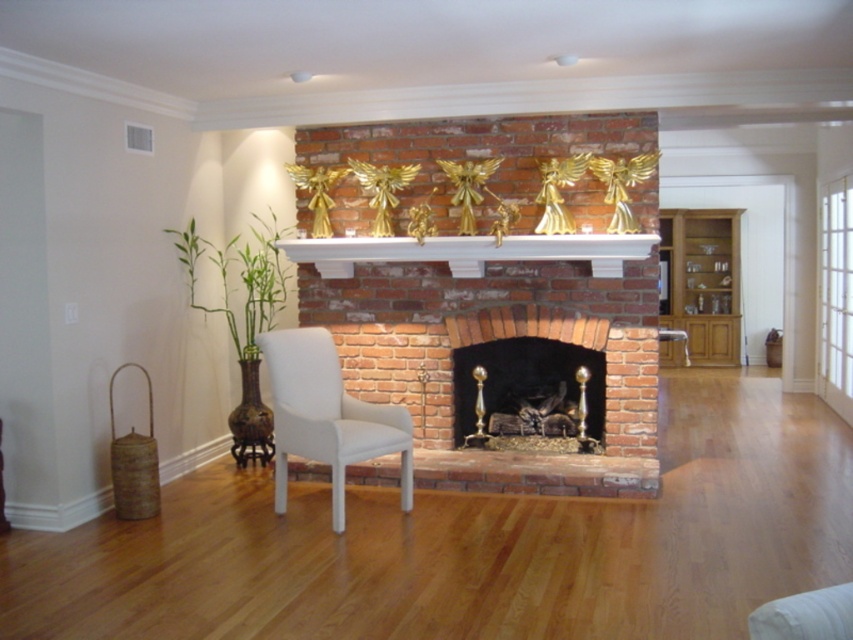
Who is higher up, white painted wood mantle at center or green bamboo at center?

white painted wood mantle at center is higher up.

Find the location of a particular element. Image resolution: width=853 pixels, height=640 pixels. white painted wood mantle at center is located at coordinates (469, 252).

Identify the location of white painted wood mantle at center. Image resolution: width=853 pixels, height=640 pixels. (469, 252).

Who is shorter, brick fireplace at center or white painted wood mantle at center?

With less height is white painted wood mantle at center.

Describe the element at coordinates (498, 339) in the screenshot. I see `brick fireplace at center` at that location.

Identify the location of brick fireplace at center. (498, 339).

Which is below, white matte armchair at center or white painted wood mantle at center?

white matte armchair at center is lower down.

Does white matte armchair at center have a greater width compared to white painted wood mantle at center?

No.

Describe the element at coordinates (328, 417) in the screenshot. This screenshot has width=853, height=640. I see `white matte armchair at center` at that location.

At what (x,y) coordinates should I click in order to perform the action: click on white matte armchair at center. Please return your answer as a coordinate pair (x, y). This screenshot has height=640, width=853. Looking at the image, I should click on (328, 417).